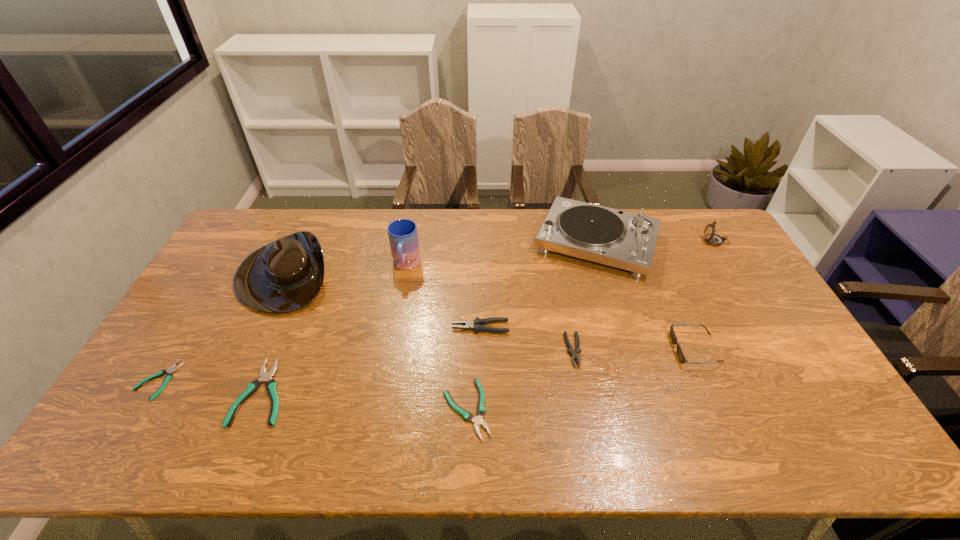
Where is `vacant area between the eighth tallest object and the smallest teal pliers`? vacant area between the eighth tallest object and the smallest teal pliers is located at coordinates (210, 386).

Locate an element on the screen. free space between the biggest teal pliers and the shortest pliers is located at coordinates (210, 386).

Identify the location of free space between the rightmost object and the rightmost teal pliers. This screenshot has height=540, width=960. (591, 325).

Locate an element on the screen. free space between the second biggest teal pliers and the record player is located at coordinates (532, 325).

Find the location of a particular element. object that can be found as the second closest to the rightmost object is located at coordinates (680, 354).

At what (x,y) coordinates should I click in order to perform the action: click on object that is the seventh closest to the rightmost object. Please return your answer as a coordinate pair (x, y). Looking at the image, I should click on (283, 276).

Locate which pliers is the second closest to the fifth shortest object. Please provide its 2D coordinates. Your answer should be formatted as a tuple, i.e. [(x, y)], where the tuple contains the x and y coordinates of a point satisfying the conditions above.

[(570, 350)]

Identify the location of the third closest pliers relative to the smaller gray pliers. (271, 385).

This screenshot has width=960, height=540. I want to click on the second closest teal pliers to the right gray pliers, so click(x=271, y=385).

At what (x,y) coordinates should I click in order to perform the action: click on teal pliers that is the nearest to the sunglasses. Please return your answer as a coordinate pair (x, y). Looking at the image, I should click on (481, 410).